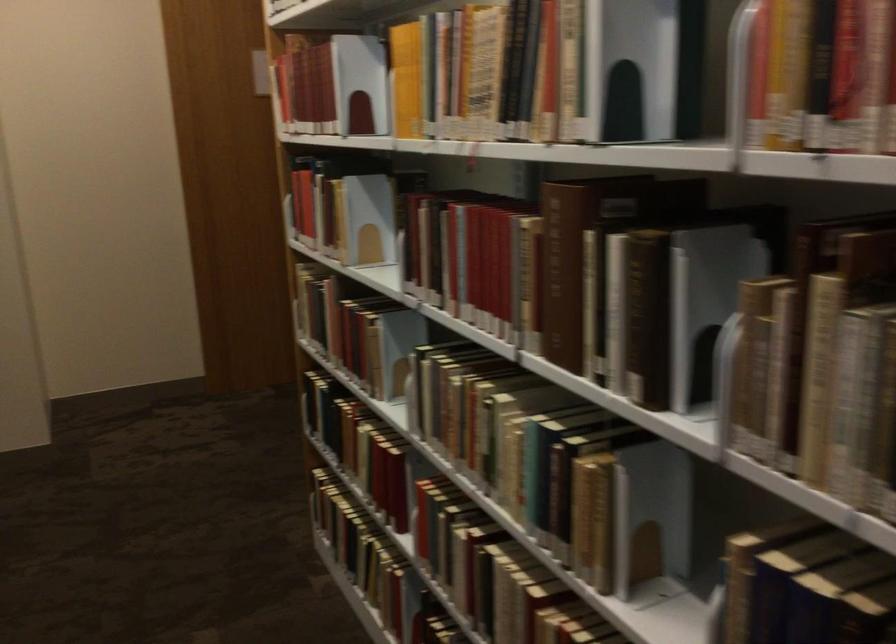
The location [351,337] corresponds to which object?

It refers to a brown book.